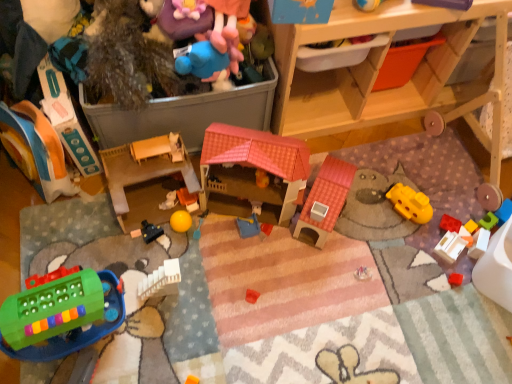
Where is `vacant space situated on the left part of blue plastic toy at center, the ninth toy positioned from the left`? This screenshot has width=512, height=384. vacant space situated on the left part of blue plastic toy at center, the ninth toy positioned from the left is located at coordinates (207, 233).